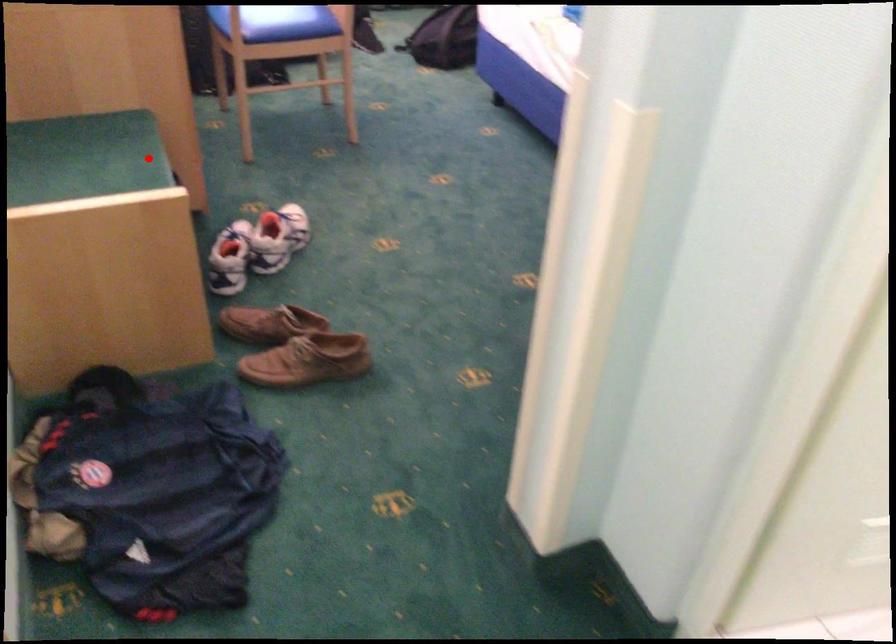
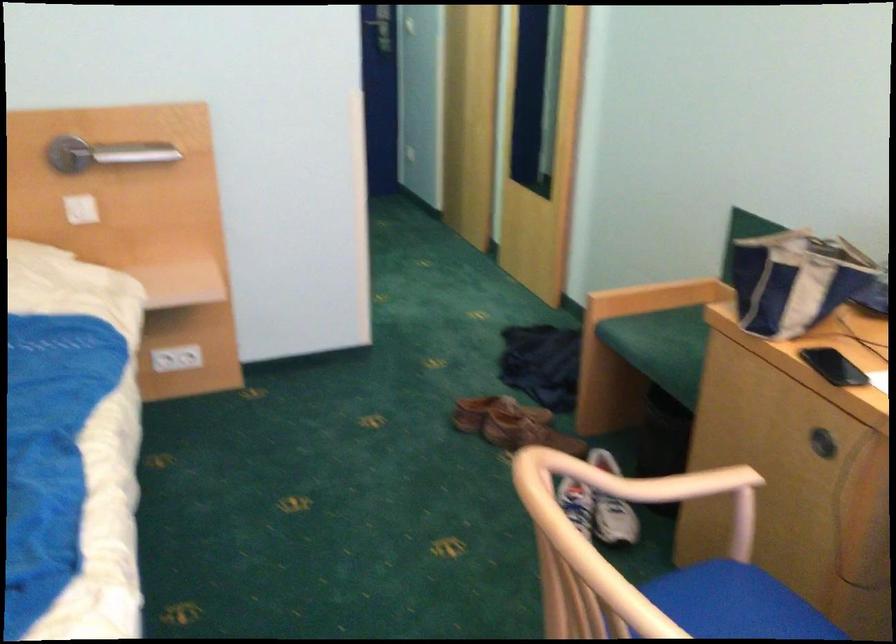
In the second image, find the point that corresponds to the highlighted location in the first image.

(661, 346)